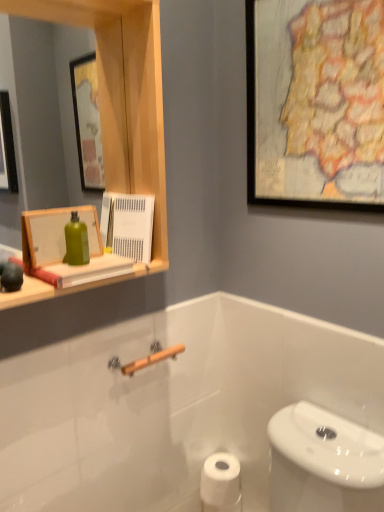
Question: Does white matte toilet paper at lower center lie in front of wooden framed map at upper right, the first picture frame viewed from the right?

Choices:
 (A) no
 (B) yes

Answer: (A)

Question: Can you confirm if white matte toilet paper at lower center is bigger than wooden framed map at upper right, positioned as the second picture frame in bottom-to-top order?

Choices:
 (A) yes
 (B) no

Answer: (B)

Question: Could you tell me if white matte toilet paper at lower center is facing wooden framed map at upper right, the second picture frame positioned from the left?

Choices:
 (A) yes
 (B) no

Answer: (B)

Question: Would you say white matte toilet paper at lower center is a long distance from wooden framed map at upper right, the first picture frame viewed from the right?

Choices:
 (A) no
 (B) yes

Answer: (B)

Question: Considering the relative positions of white matte toilet paper at lower center and wooden framed map at upper right, positioned as the second picture frame in bottom-to-top order, in the image provided, is white matte toilet paper at lower center behind wooden framed map at upper right, positioned as the second picture frame in bottom-to-top order,?

Choices:
 (A) yes
 (B) no

Answer: (A)

Question: Considering the relative sizes of white matte toilet paper at lower center and wooden framed map at upper right, positioned as the second picture frame in bottom-to-top order, in the image provided, is white matte toilet paper at lower center shorter than wooden framed map at upper right, positioned as the second picture frame in bottom-to-top order,?

Choices:
 (A) no
 (B) yes

Answer: (B)

Question: Is wooden medicine cabinet at upper left oriented away from wooden framed map at upper right, the first picture frame viewed from the right?

Choices:
 (A) no
 (B) yes

Answer: (A)

Question: Is wooden medicine cabinet at upper left not within wooden framed map at upper right, which ranks as the first picture frame in top-to-bottom order?

Choices:
 (A) yes
 (B) no

Answer: (A)

Question: Does wooden medicine cabinet at upper left lie in front of wooden framed map at upper right, the first picture frame viewed from the right?

Choices:
 (A) no
 (B) yes

Answer: (B)

Question: Is wooden medicine cabinet at upper left further to camera compared to wooden framed map at upper right, the first picture frame viewed from the right?

Choices:
 (A) no
 (B) yes

Answer: (A)

Question: Does wooden medicine cabinet at upper left touch wooden framed map at upper right, which ranks as the first picture frame in top-to-bottom order?

Choices:
 (A) no
 (B) yes

Answer: (A)

Question: From the image's perspective, is wooden medicine cabinet at upper left beneath wooden framed map at upper right, the second picture frame positioned from the left?

Choices:
 (A) no
 (B) yes

Answer: (B)

Question: Does wooden medicine cabinet at upper left have a larger size compared to white matte toilet paper at lower center?

Choices:
 (A) yes
 (B) no

Answer: (A)